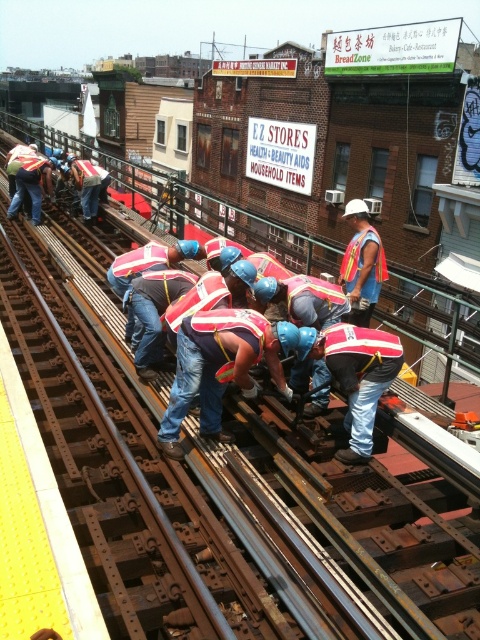
You are a safety inspector checking the distance between two workers in a railway maintenance area. You see a red reflective vest at center and a reflective orange vest at center. According to safety regulations, workers must maintain a minimum distance of 5 feet apart to avoid collision risks. Can you confirm if they are compliant?

The red reflective vest at center and reflective orange vest at center are 6.72 feet apart from each other, which exceeds the required 5 feet minimum distance. Therefore, they are compliant with safety regulations.

You are a safety inspector checking the equipment of workers on the elevated railway tracks. You notice both the red reflective vest at center and the reflective silver helmet at center. Which piece of equipment is wider?

The red reflective vest at center is wider than the reflective silver helmet at center according to the description.